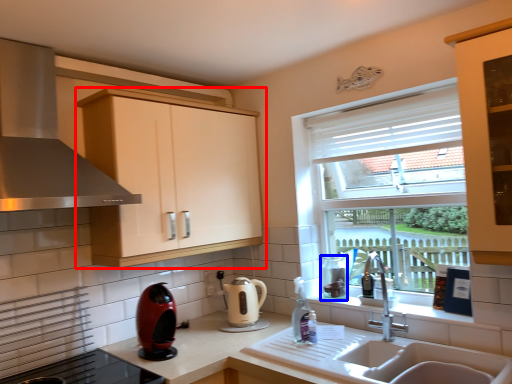
Question: Which point is closer to the camera, cabinetry (highlighted by a red box) or appliance (highlighted by a blue box)?

Choices:
 (A) cabinetry
 (B) appliance

Answer: (A)